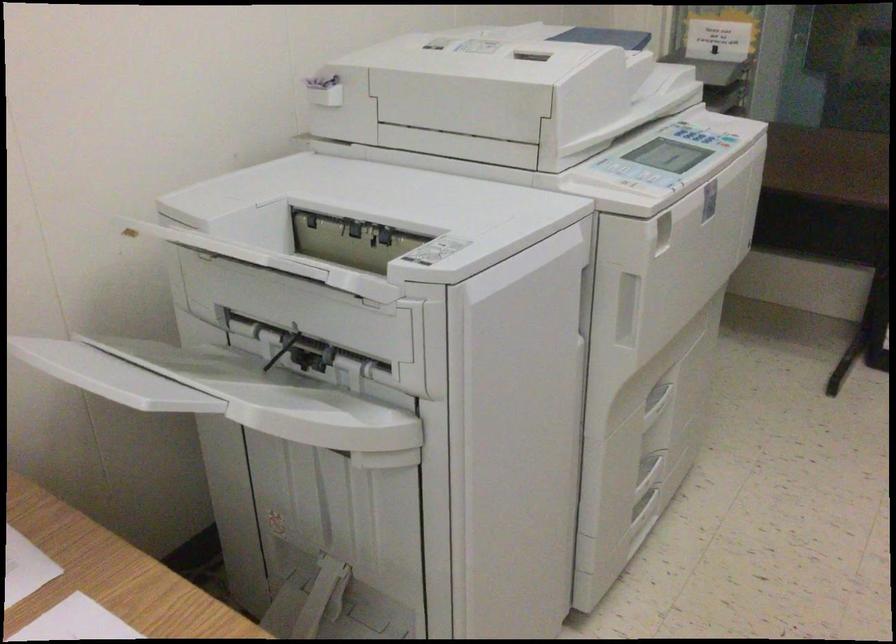
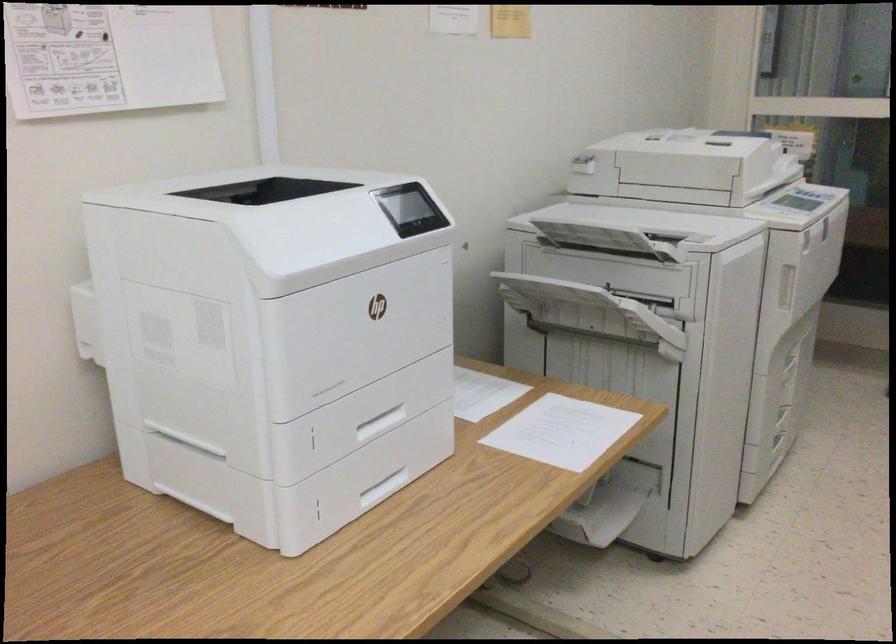
The point at (319, 307) is marked in the first image. Where is the corresponding point in the second image?

(623, 270)